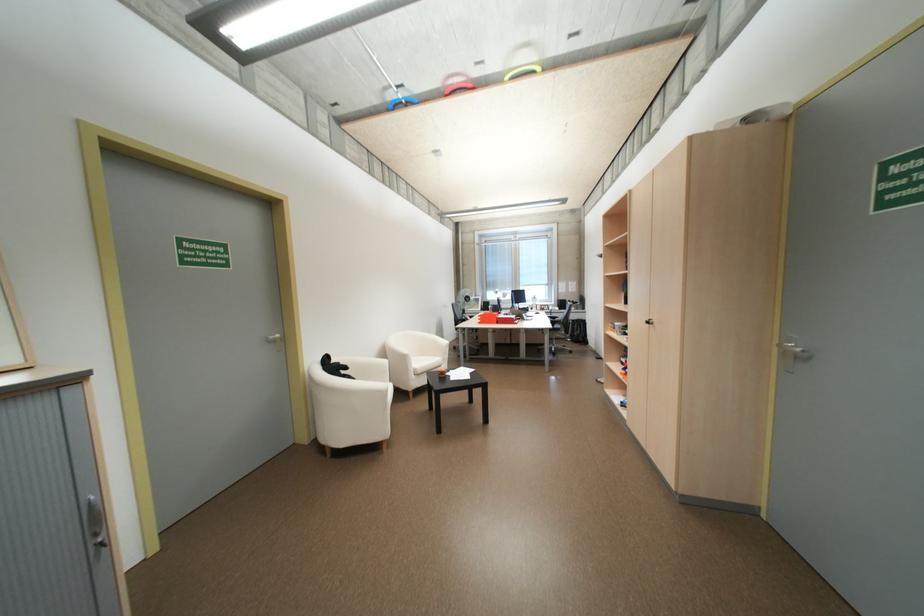
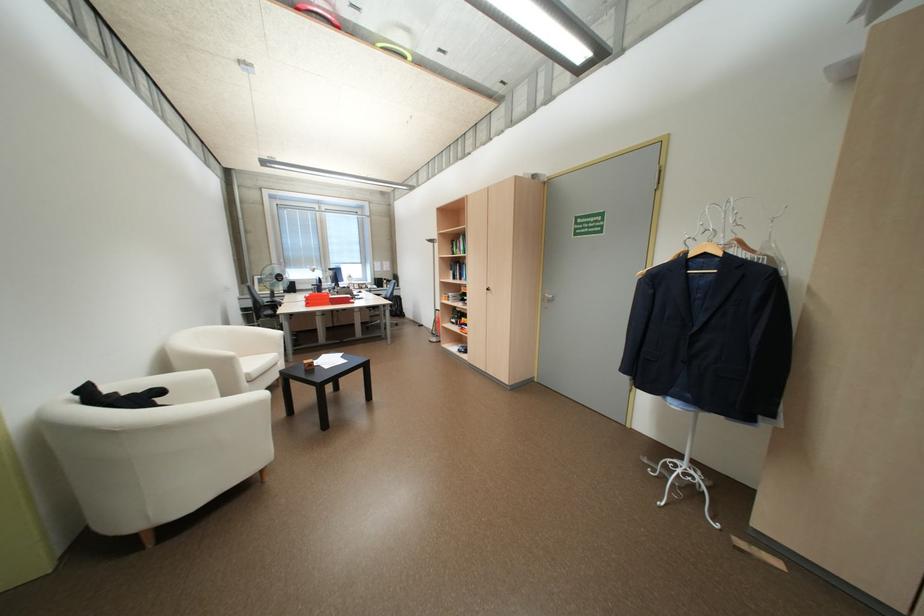
Locate, in the second image, the point that corresponds to the point at 511,315 in the first image.

(342, 296)